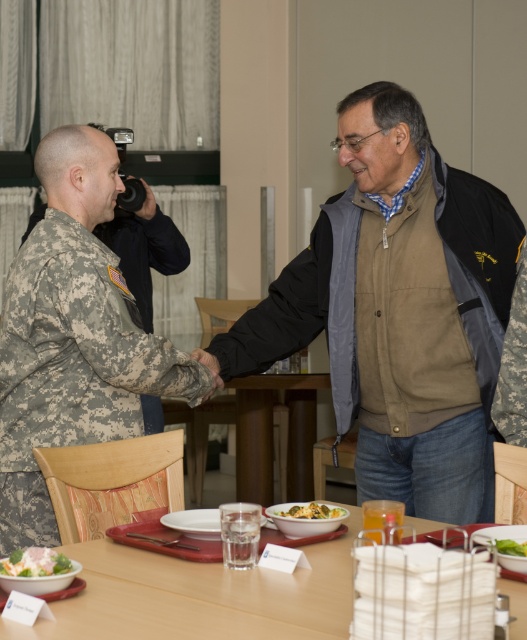
You are a chef standing at the edge of the wooden table at lower center and you want to reach the yellowish matte pasta at center. Can you stretch your hand to get it without moving your feet?

The distance between the wooden table at lower center and the yellowish matte pasta at center is 12.32 inches. Since the pasta is on the table, the chef can easily reach it without moving their feet as the distance is within arm reach.

You are a guest at this dinner and want to reach for the white creamy salad at lower left and the yellowish matte pasta at center. Which one is closer to you?

The white creamy salad at lower left is closer to you since it is in front of the yellowish matte pasta at center.

You are a waiter carrying a tray of food and need to place it on the wooden table at lower center. Considering your height is 1.7 meters, will you be able to comfortably reach the table?

The wooden table at lower center is 1.62 meters away from the camera, so yes, the waiter can comfortably reach the table since it is within a reasonable distance and the height of the table is likely appropriate for placing a tray.